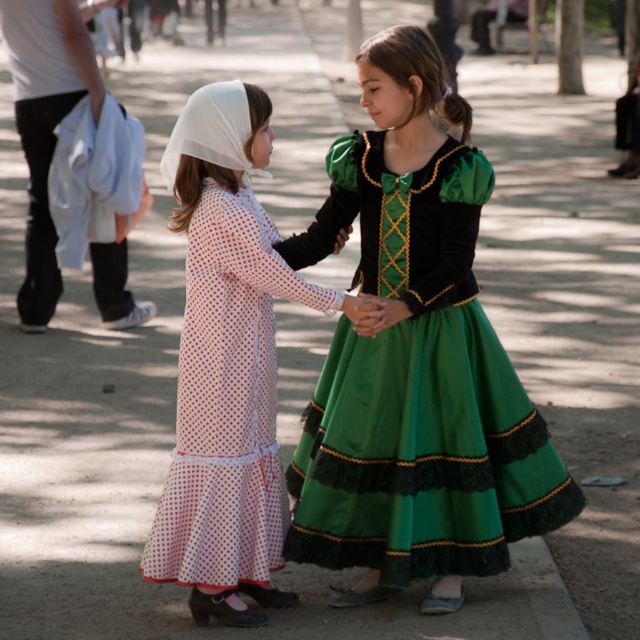
You are a photographer trying to capture the two girls in the scene. You notice the white dotted fabric dress at left and the white cotton shirt at left. Which clothing item is closer to the camera?

The white dotted fabric dress at left is positioned under the white cotton shirt at left, so the white cotton shirt at left is closer to the camera.

You are organizing a clothing display and need to decide which outfit takes up more space. Based on the image, which item is larger in size between the green satin dress at center and the white cotton shirt at left?

The green satin dress at center has a larger size compared to the white cotton shirt at left, so the green satin dress at center takes up more space.

Based on the scene description, which clothing item is shorter in height between the green satin dress at center and the white cotton shirt at left?

The green satin dress at center is not as tall as the white cotton shirt at left, so the green satin dress at center is shorter in height.